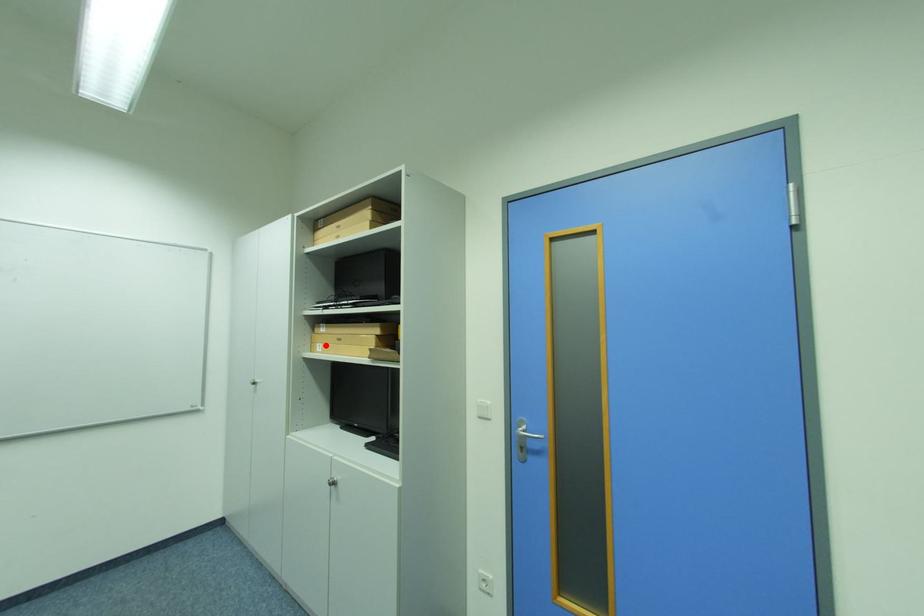
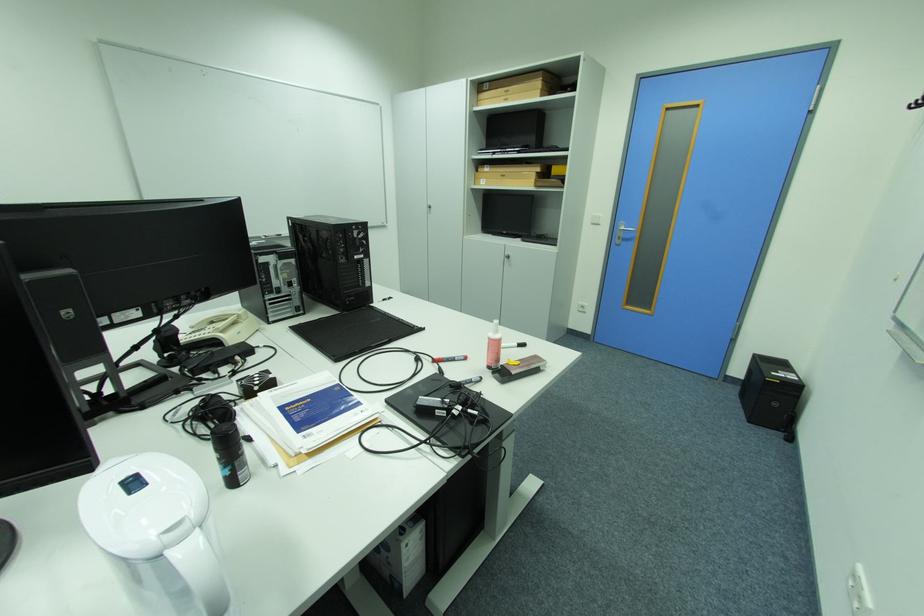
Question: I am providing you with two images of the same scene from different viewpoints. In image1, a red point is highlighted. Considering the same 3D point in image2, which of the following is correct?

Choices:
 (A) It is closer
 (B) It is farther

Answer: (A)